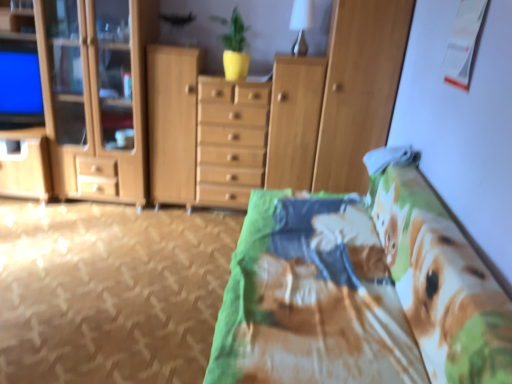
Question: Is wooden cabinet at center outside wooden cabinet at left, which ranks as the second cabinetry in right-to-left order?

Choices:
 (A) yes
 (B) no

Answer: (A)

Question: Is wooden cabinet at center taller than wooden cabinet at left, which ranks as the second cabinetry in right-to-left order?

Choices:
 (A) no
 (B) yes

Answer: (A)

Question: Can you confirm if wooden cabinet at center is shorter than wooden cabinet at left, which ranks as the second cabinetry in right-to-left order?

Choices:
 (A) yes
 (B) no

Answer: (A)

Question: Is wooden cabinet at center to the right of wooden cabinet at left, which ranks as the second cabinetry in right-to-left order, from the viewer's perspective?

Choices:
 (A) no
 (B) yes

Answer: (B)

Question: From the image's perspective, would you say wooden cabinet at center is positioned over wooden cabinet at left, which ranks as the 1th cabinetry in left-to-right order?

Choices:
 (A) no
 (B) yes

Answer: (A)

Question: From a real-world perspective, is wooden cabinet at left, which ranks as the second cabinetry in right-to-left order, above or below printed fabric bed at center?

Choices:
 (A) above
 (B) below

Answer: (A)

Question: Would you say wooden cabinet at left, which ranks as the second cabinetry in right-to-left order, is to the left or to the right of printed fabric bed at center in the picture?

Choices:
 (A) right
 (B) left

Answer: (B)

Question: In terms of size, does wooden cabinet at left, which ranks as the second cabinetry in right-to-left order, appear bigger or smaller than printed fabric bed at center?

Choices:
 (A) small
 (B) big

Answer: (A)

Question: Is wooden cabinet at left, which ranks as the 1th cabinetry in left-to-right order, inside or outside of printed fabric bed at center?

Choices:
 (A) inside
 (B) outside

Answer: (B)

Question: Is wooden cabinet at left, which ranks as the 1th cabinetry in left-to-right order, to the left or to the right of wooden cabinet at center in the image?

Choices:
 (A) left
 (B) right

Answer: (A)

Question: Is point (143, 152) closer or farther from the camera than point (163, 69)?

Choices:
 (A) closer
 (B) farther

Answer: (B)

Question: Is wooden cabinet at left, which ranks as the second cabinetry in right-to-left order, wider or thinner than wooden cabinet at center?

Choices:
 (A) thin
 (B) wide

Answer: (B)

Question: From their relative heights in the image, would you say wooden cabinet at left, which ranks as the 1th cabinetry in left-to-right order, is taller or shorter than wooden cabinet at center?

Choices:
 (A) short
 (B) tall

Answer: (B)

Question: Is printed fabric bed at center situated inside wooden cabinet at left, which ranks as the 1th cabinetry in left-to-right order, or outside?

Choices:
 (A) outside
 (B) inside

Answer: (A)

Question: Is point (397, 370) closer or farther from the camera than point (134, 31)?

Choices:
 (A) closer
 (B) farther

Answer: (A)